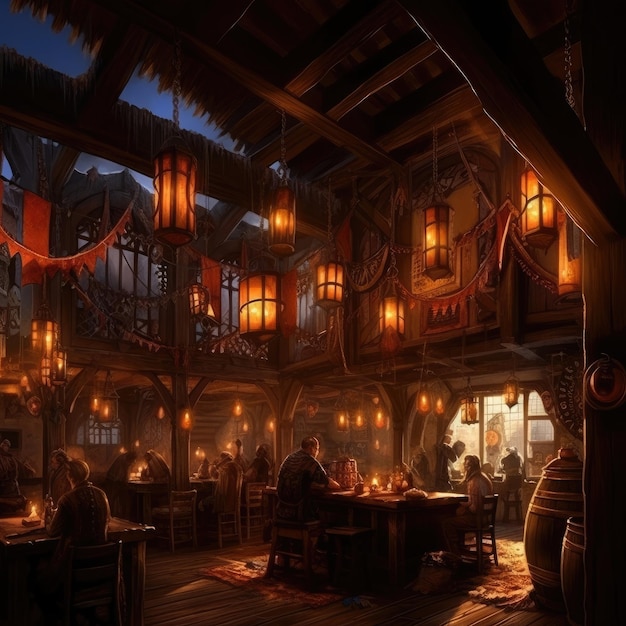
Look for where you'd sit in the image and show me where they are. Your answer should be formatted as a list of tuples, i.e. [(x1, y1), (x2, y2), ...], where each tuple contains the x and y coordinates of a point satisfying the conditions above.

[(165, 509)]